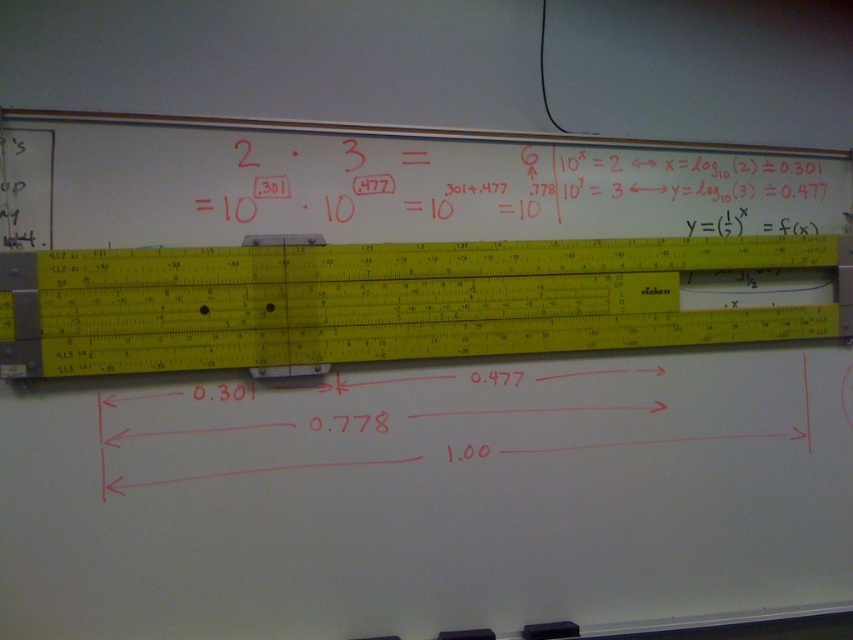
Is point (531, 280) positioned before point (459, 141)?

Yes, point (531, 280) is closer to viewer.

Which is below, yellow plastic ruler at center or white chalk math equations at center?

yellow plastic ruler at center is lower down.

Where is `yellow plastic ruler at center`? yellow plastic ruler at center is located at coordinates (386, 301).